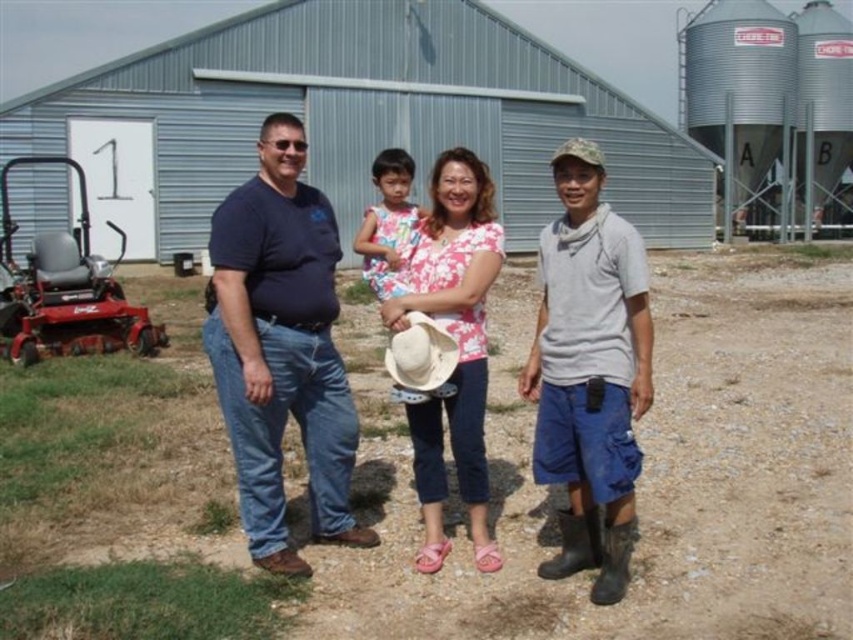
You are standing at the red riding lawn mower near the barn and want to walk to the point labeled with the number 1 on the barn. Which direction should you walk relative to the two points, point (88, 392) and point (412, 426)?

Since point (88, 392) is closer to you than point (412, 426), you should walk towards the direction of point (88, 392) to reach the sign labeled with the number 1 on the barn.

You are standing at the edge of the field looking towards the barn. You see a dirt at center and a floral fabric shirt at center. Which object is closer to you?

The dirt at center is closer to you because it is in front of the floral fabric shirt at center.

Consider the image. You are a photographer standing at the edge of the field. You want to take a photo of the gray cotton shirt at center and the white matte cowboy hat at center. If your camera has a maximum focus range of 28 inches, will both subjects be in focus?

The distance between the gray cotton shirt at center and the white matte cowboy hat at center is 28.46 inches, which exceeds the camera maximum focus range of 28 inches. Therefore, both subjects cannot be in focus simultaneously.